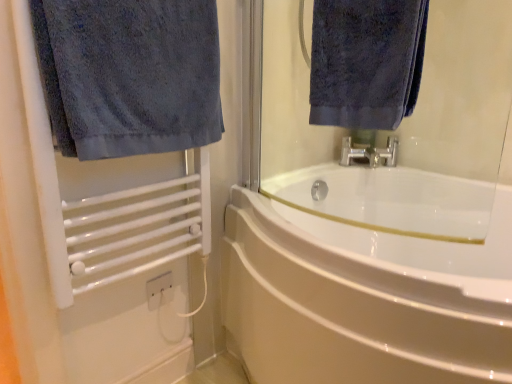
The image size is (512, 384). Find the location of `white matte towel rack at left`. white matte towel rack at left is located at coordinates (99, 240).

Where is `dark blue terry cloth towel at upper center, the second towel when ordered from left to right`? dark blue terry cloth towel at upper center, the second towel when ordered from left to right is located at coordinates (366, 61).

How much space does dark blue terry cloth towel at left, arranged as the first towel when viewed from the left, occupy vertically?

14.53 inches.

At what (x,y) coordinates should I click in order to perform the action: click on white matte towel rack at left. Please return your answer as a coordinate pair (x, y). This screenshot has height=384, width=512. Looking at the image, I should click on (99, 240).

Considering the relative sizes of white matte towel rack at left and white glossy bathtub at center in the image provided, is white matte towel rack at left taller than white glossy bathtub at center?

Yes, white matte towel rack at left is taller than white glossy bathtub at center.

From a real-world perspective, is white matte towel rack at left under white glossy bathtub at center?

No, from a real-world perspective, white matte towel rack at left is not under white glossy bathtub at center.

From the image's perspective, which one is positioned lower, white matte towel rack at left or white glossy bathtub at center?

white glossy bathtub at center appears lower in the image.

From a real-world perspective, is white matte towel rack at left positioned over dark blue terry cloth towel at upper center, placed as the first towel when sorted from right to left, based on gravity?

No, from a real-world perspective, white matte towel rack at left is not on top of dark blue terry cloth towel at upper center, placed as the first towel when sorted from right to left.

Does white matte towel rack at left appear on the right side of dark blue terry cloth towel at upper center, the second towel when ordered from left to right?

In fact, white matte towel rack at left is to the left of dark blue terry cloth towel at upper center, the second towel when ordered from left to right.

Which of these two, white matte towel rack at left or dark blue terry cloth towel at upper center, the second towel when ordered from left to right, is smaller?

dark blue terry cloth towel at upper center, the second towel when ordered from left to right.

Is white matte towel rack at left positioned behind dark blue terry cloth towel at upper center, the second towel when ordered from left to right?

No.

Is dark blue terry cloth towel at left, which is counted as the second towel, starting from the right, turned away from white matte towel rack at left?

Yes, dark blue terry cloth towel at left, which is counted as the second towel, starting from the right,'s orientation is away from white matte towel rack at left.

Considering the relative sizes of dark blue terry cloth towel at left, which is counted as the second towel, starting from the right, and white matte towel rack at left in the image provided, is dark blue terry cloth towel at left, which is counted as the second towel, starting from the right, wider than white matte towel rack at left?

Correct, the width of dark blue terry cloth towel at left, which is counted as the second towel, starting from the right, exceeds that of white matte towel rack at left.

Considering the relative positions of dark blue terry cloth towel at left, which is counted as the second towel, starting from the right, and white matte towel rack at left in the image provided, is dark blue terry cloth towel at left, which is counted as the second towel, starting from the right, to the left of white matte towel rack at left from the viewer's perspective?

In fact, dark blue terry cloth towel at left, which is counted as the second towel, starting from the right, is to the right of white matte towel rack at left.

From the image's perspective, count 1st towels upward from the white matte towel rack at left and point to it. Please provide its 2D coordinates.

[(129, 75)]

This screenshot has height=384, width=512. I want to click on towel located on the right of dark blue terry cloth towel at left, arranged as the first towel when viewed from the left, so click(x=366, y=61).

Looking at this image, considering the relative positions of dark blue terry cloth towel at left, arranged as the first towel when viewed from the left, and dark blue terry cloth towel at upper center, the second towel when ordered from left to right, in the image provided, is dark blue terry cloth towel at left, arranged as the first towel when viewed from the left, to the left of dark blue terry cloth towel at upper center, the second towel when ordered from left to right, from the viewer's perspective?

Yes, dark blue terry cloth towel at left, arranged as the first towel when viewed from the left, is to the left of dark blue terry cloth towel at upper center, the second towel when ordered from left to right.

Which point is more distant from viewer, (119, 26) or (393, 70)?

The point (393, 70) is farther from the camera.

Considering the relative sizes of dark blue terry cloth towel at left, which is counted as the second towel, starting from the right, and dark blue terry cloth towel at upper center, placed as the first towel when sorted from right to left, in the image provided, is dark blue terry cloth towel at left, which is counted as the second towel, starting from the right, smaller than dark blue terry cloth towel at upper center, placed as the first towel when sorted from right to left,?

No.

Can you tell me how much white glossy bathtub at center and white matte towel rack at left differ in facing direction?

91.8 degrees.

From a real-world perspective, is white glossy bathtub at center positioned above or below white matte towel rack at left?

In terms of real-world spatial position, white glossy bathtub at center is below white matte towel rack at left.

Does point (441, 307) come in front of point (100, 357)?

Yes, it is.

This screenshot has height=384, width=512. In order to click on screen door to the left of white glossy bathtub at center in this screenshot , I will do `click(99, 240)`.

In the scene shown: Is white matte towel rack at left at the back of dark blue terry cloth towel at upper center, the second towel when ordered from left to right?

No, white matte towel rack at left is not at the back of dark blue terry cloth towel at upper center, the second towel when ordered from left to right.

Between dark blue terry cloth towel at upper center, the second towel when ordered from left to right, and white matte towel rack at left, which one has larger width?

dark blue terry cloth towel at upper center, the second towel when ordered from left to right, is wider.

Is white matte towel rack at left completely or partially inside dark blue terry cloth towel at upper center, the second towel when ordered from left to right?

No, white matte towel rack at left is not a part of dark blue terry cloth towel at upper center, the second towel when ordered from left to right.

Image resolution: width=512 pixels, height=384 pixels. I want to click on towel that is in front of the white matte towel rack at left, so (x=129, y=75).

Which is more to the left, white matte towel rack at left or dark blue terry cloth towel at left, arranged as the first towel when viewed from the left?

From the viewer's perspective, white matte towel rack at left appears more on the left side.

From the image's perspective, is white matte towel rack at left located above or below dark blue terry cloth towel at left, which is counted as the second towel, starting from the right?

white matte towel rack at left is below dark blue terry cloth towel at left, which is counted as the second towel, starting from the right.

From a real-world perspective, which is physically below, white matte towel rack at left or dark blue terry cloth towel at left, arranged as the first towel when viewed from the left?

From a 3D spatial view, white matte towel rack at left is below.

What are the coordinates of `screen door positioned vertically above the white glossy bathtub at center (from a real-world perspective)` in the screenshot? It's located at pos(99,240).

Identify the location of towel behind the white matte towel rack at left. (366, 61).

Estimate the real-world distances between objects in this image. Which object is closer to dark blue terry cloth towel at left, arranged as the first towel when viewed from the left, white matte towel rack at left or dark blue terry cloth towel at upper center, placed as the first towel when sorted from right to left?

white matte towel rack at left is closer to dark blue terry cloth towel at left, arranged as the first towel when viewed from the left.

Based on their spatial positions, is white glossy bathtub at center or white matte towel rack at left closer to dark blue terry cloth towel at left, arranged as the first towel when viewed from the left?

white matte towel rack at left lies closer to dark blue terry cloth towel at left, arranged as the first towel when viewed from the left, than the other object.

When comparing their distances from white matte towel rack at left, does white glossy bathtub at center or dark blue terry cloth towel at left, arranged as the first towel when viewed from the left, seem closer?

dark blue terry cloth towel at left, arranged as the first towel when viewed from the left, lies closer to white matte towel rack at left than the other object.

From the image, which object appears to be farther from white matte towel rack at left, dark blue terry cloth towel at upper center, the second towel when ordered from left to right, or white glossy bathtub at center?

The object further to white matte towel rack at left is dark blue terry cloth towel at upper center, the second towel when ordered from left to right.

Based on their spatial positions, is dark blue terry cloth towel at upper center, the second towel when ordered from left to right, or white matte towel rack at left closer to white glossy bathtub at center?

white matte towel rack at left is positioned closer to the anchor white glossy bathtub at center.

Looking at the image, which one is located further to dark blue terry cloth towel at upper center, the second towel when ordered from left to right, white glossy bathtub at center or white matte towel rack at left?

Among the two, white matte towel rack at left is located further to dark blue terry cloth towel at upper center, the second towel when ordered from left to right.

From the image, which object appears to be farther from dark blue terry cloth towel at upper center, the second towel when ordered from left to right, dark blue terry cloth towel at left, arranged as the first towel when viewed from the left, or white matte towel rack at left?

Among the two, white matte towel rack at left is located further to dark blue terry cloth towel at upper center, the second towel when ordered from left to right.

When comparing their distances from dark blue terry cloth towel at left, which is counted as the second towel, starting from the right, does dark blue terry cloth towel at upper center, placed as the first towel when sorted from right to left, or white matte towel rack at left seem closer?

white matte towel rack at left is positioned closer to the anchor dark blue terry cloth towel at left, which is counted as the second towel, starting from the right.

Find the location of a particular element. The image size is (512, 384). towel located between white matte towel rack at left and dark blue terry cloth towel at upper center, placed as the first towel when sorted from right to left, in the left-right direction is located at coordinates (129, 75).

Where is `towel between dark blue terry cloth towel at left, arranged as the first towel when viewed from the left, and white glossy bathtub at center`? Image resolution: width=512 pixels, height=384 pixels. towel between dark blue terry cloth towel at left, arranged as the first towel when viewed from the left, and white glossy bathtub at center is located at coordinates 366,61.